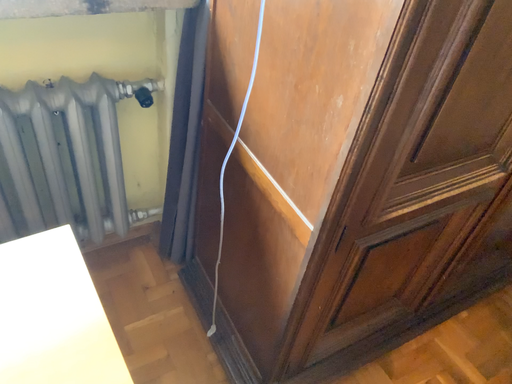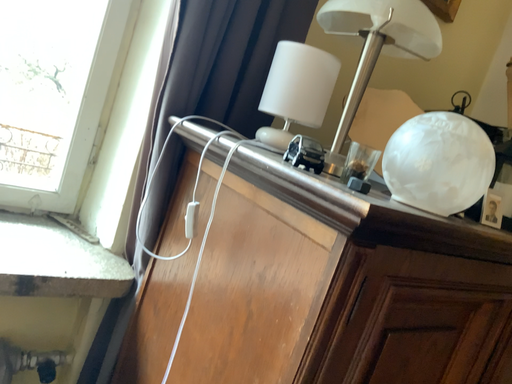
Question: Which way did the camera rotate in the video?

Choices:
 (A) rotated downward
 (B) rotated upward

Answer: (B)